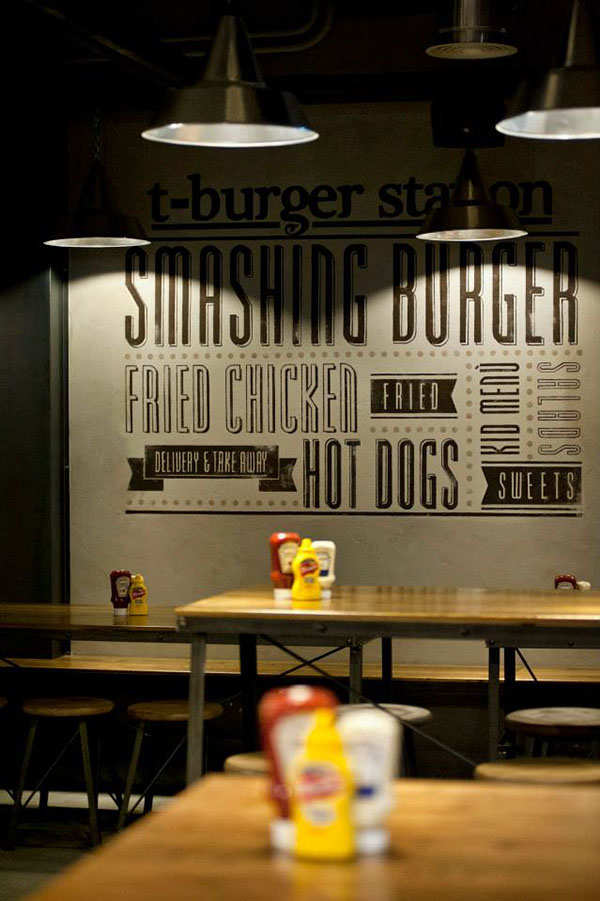
The width and height of the screenshot is (600, 901). What are the coordinates of `stool` in the screenshot? It's located at (530, 776), (570, 719), (415, 706), (161, 712), (75, 711).